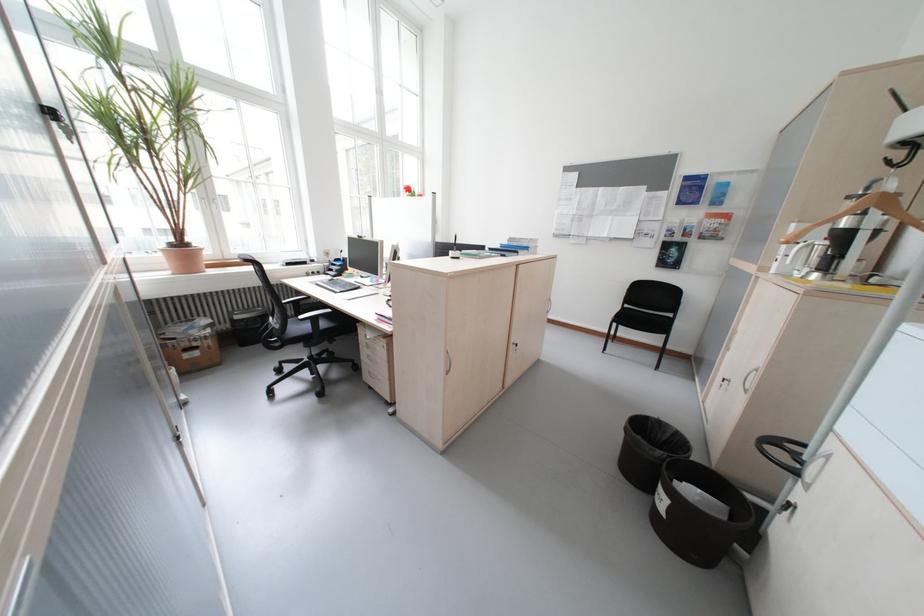
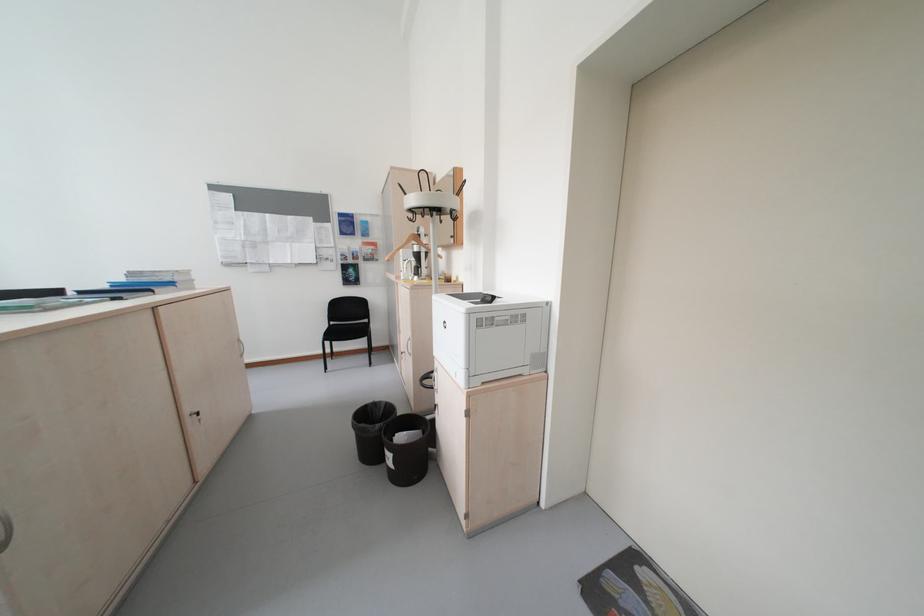
The point at (677, 426) is marked in the first image. Where is the corresponding point in the second image?

(391, 403)